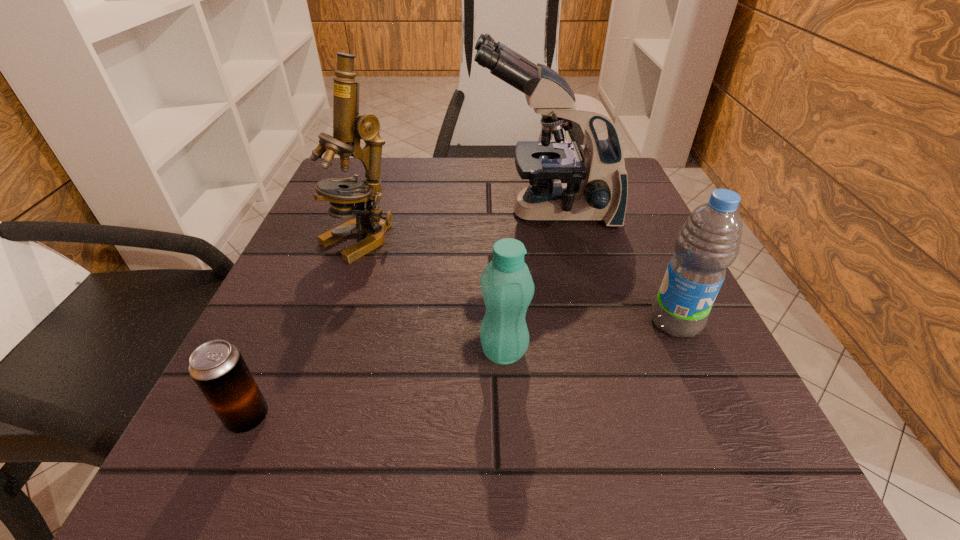
Locate an element on the screen. vacant space situated 0.300m on the left of the water bottle is located at coordinates (454, 322).

Where is `free location located on the back of the fourth tallest object`? This screenshot has height=540, width=960. free location located on the back of the fourth tallest object is located at coordinates (498, 259).

Where is `vacant area situated 0.220m on the back of the nearest object`? Image resolution: width=960 pixels, height=540 pixels. vacant area situated 0.220m on the back of the nearest object is located at coordinates (306, 287).

At what (x,y) coordinates should I click in order to perform the action: click on object located in the far edge section of the desktop. Please return your answer as a coordinate pair (x, y). This screenshot has width=960, height=540. Looking at the image, I should click on (594, 186).

The width and height of the screenshot is (960, 540). What are the coordinates of `microscope that is at the left edge` in the screenshot? It's located at (349, 127).

Identify the location of beer can that is positioned at the left edge. This screenshot has width=960, height=540. (217, 367).

Locate an element on the screen. microscope that is positioned at the right edge is located at coordinates (594, 186).

Where is `water bottle present at the right edge`? water bottle present at the right edge is located at coordinates (709, 241).

This screenshot has height=540, width=960. Identify the location of object located in the far right corner section of the desktop. (594, 186).

This screenshot has width=960, height=540. In the image, there is a desktop. Find the location of `free region at the far edge`. free region at the far edge is located at coordinates (462, 180).